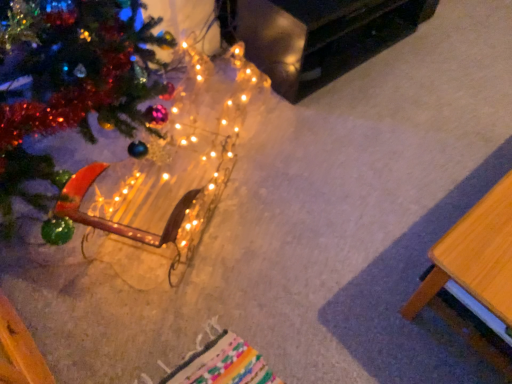
Where is `free space on the front side of illuminated wireframe horse at lower left`? This screenshot has height=384, width=512. free space on the front side of illuminated wireframe horse at lower left is located at coordinates (x=186, y=307).